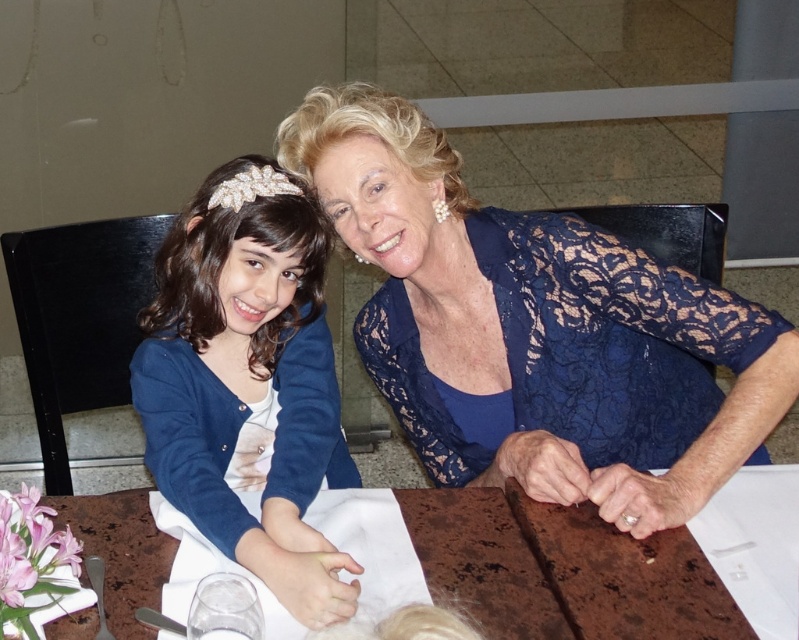
Question: Which of the following is the farthest from the observer?

Choices:
 (A) brown marble table at center
 (B) matte blue sweater at left

Answer: (B)

Question: Which point is closer to the camera?

Choices:
 (A) matte blue sweater at left
 (B) lace fabric at center
 (C) brown marble table at center

Answer: (C)

Question: Which point is closer to the camera taking this photo?

Choices:
 (A) (74, 515)
 (B) (257, 264)
 (C) (466, 317)

Answer: (A)

Question: From the image, what is the correct spatial relationship of lace fabric at center in relation to brown marble table at center?

Choices:
 (A) left
 (B) right

Answer: (A)

Question: Does lace fabric at center come in front of brown marble table at center?

Choices:
 (A) yes
 (B) no

Answer: (B)

Question: Is lace fabric at center smaller than matte blue sweater at left?

Choices:
 (A) no
 (B) yes

Answer: (A)